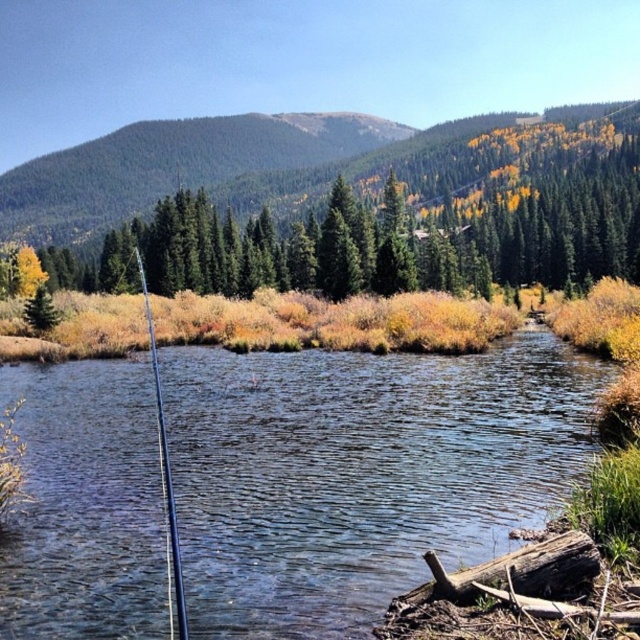
Who is positioned more to the left, clear water at center or green matte tree at upper center?

clear water at center is more to the left.

Between point (184, 362) and point (36, 202), which one is positioned in front?

Point (184, 362) is more forward.

Locate an element on the screen. The height and width of the screenshot is (640, 640). clear water at center is located at coordinates (362, 474).

Can you confirm if clear water at center is positioned above silver metallic fishing pole at center?

No.

Can you confirm if clear water at center is smaller than silver metallic fishing pole at center?

Yes, clear water at center is smaller than silver metallic fishing pole at center.

Is point (221, 612) less distant than point (147, 321)?

Yes, it is.

Where is `clear water at center`? Image resolution: width=640 pixels, height=640 pixels. clear water at center is located at coordinates point(362,474).

Who is positioned more to the right, green matte tree at upper center or silver metallic fishing pole at center?

From the viewer's perspective, green matte tree at upper center appears more on the right side.

Which is in front, point (506, 250) or point (168, 474)?

Point (168, 474) is in front.

Is point (636, 157) farther from camera compared to point (173, 570)?

Yes, it is behind point (173, 570).

I want to click on green matte tree at upper center, so click(340, 204).